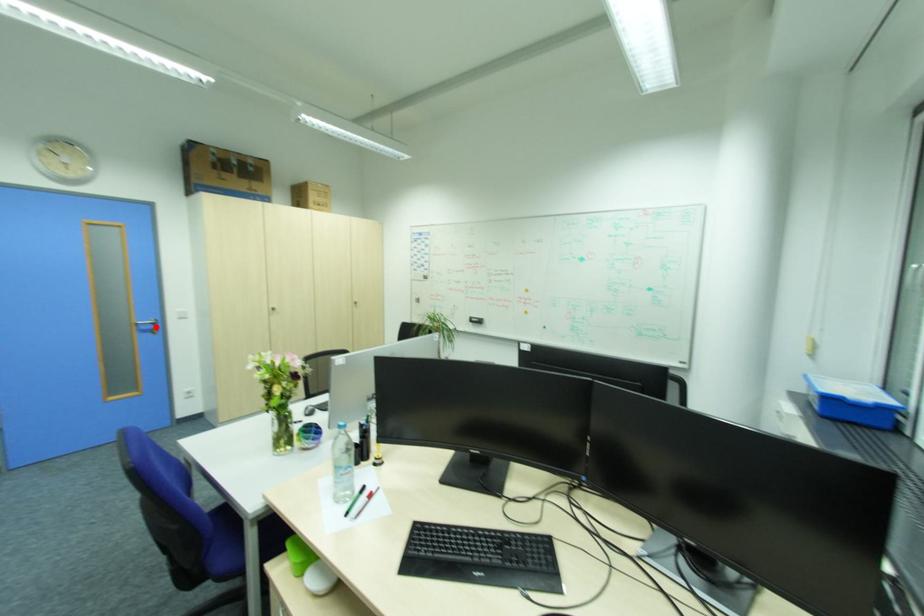
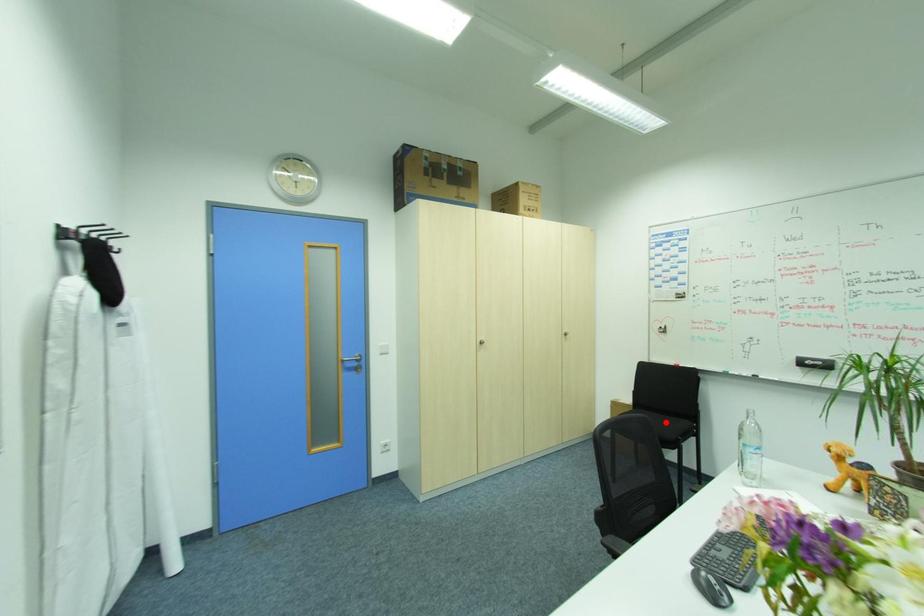
I am providing you with two images of the same scene from different viewpoints. A red point is marked on the first image and another point is marked on the second image. Are the points marked in image1 and image2 representing the same 3D position?

No